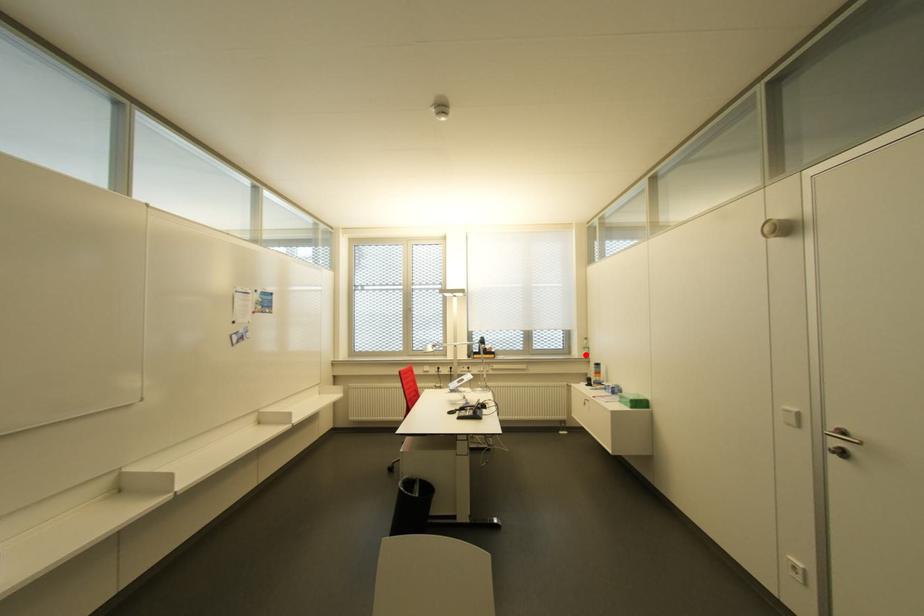
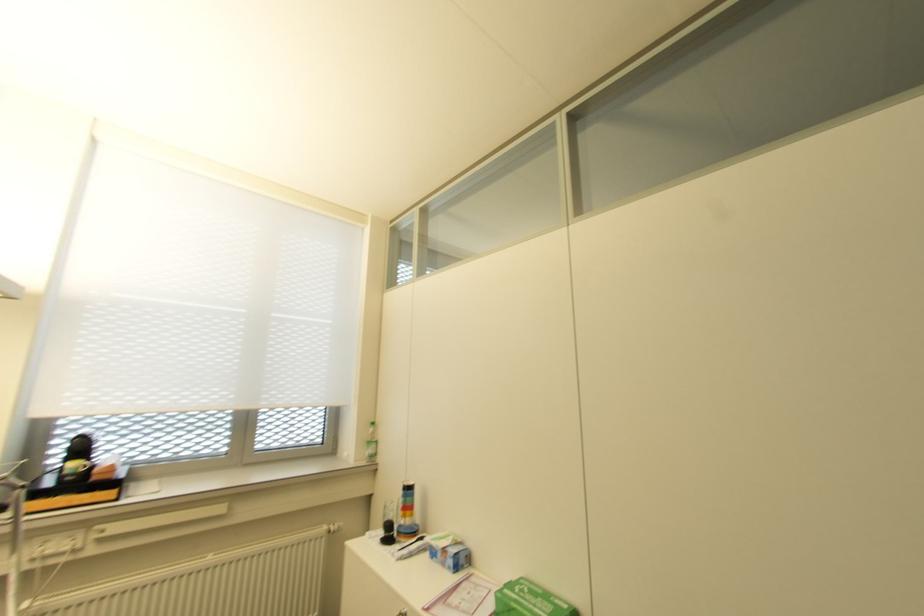
Question: I am providing you with two images of the same scene from different viewpoints. In image1, a red point is highlighted. Considering the same 3D point in image2, which of the following is correct?

Choices:
 (A) It is closer
 (B) It is farther

Answer: (B)